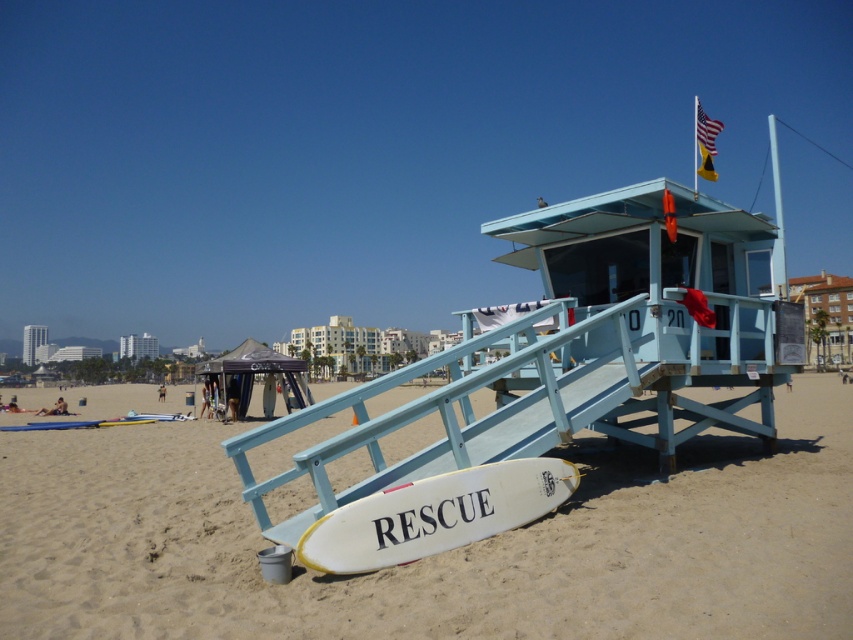
You are a photographer planning to take a photo of the white sand at lower center and the white matte surfboard at lower center. Since you want to ensure both objects are fully visible in the frame, which object requires more horizontal space in the camera viewfinder?

The white sand at lower center requires more horizontal space in the camera viewfinder because its width is larger than the white matte surfboard at lower center.

You are standing at point (828, 589) and want to walk to the lifeguard tower. Which direction should you go relative to point (207, 372)?

Since point (828, 589) is in front of point (207, 372), you should walk towards the direction away from point (207, 372) to reach the lifeguard tower.